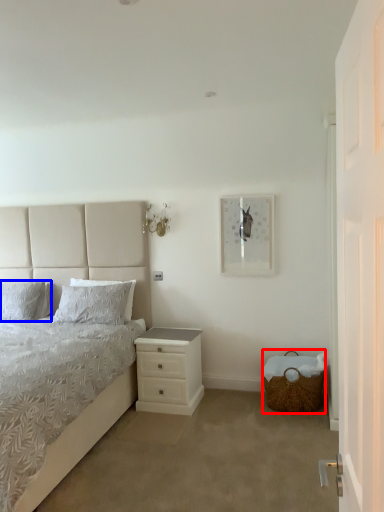
Question: Which object appears closest to the camera in this image, basket (highlighted by a red box) or pillow (highlighted by a blue box)?

Choices:
 (A) basket
 (B) pillow

Answer: (A)